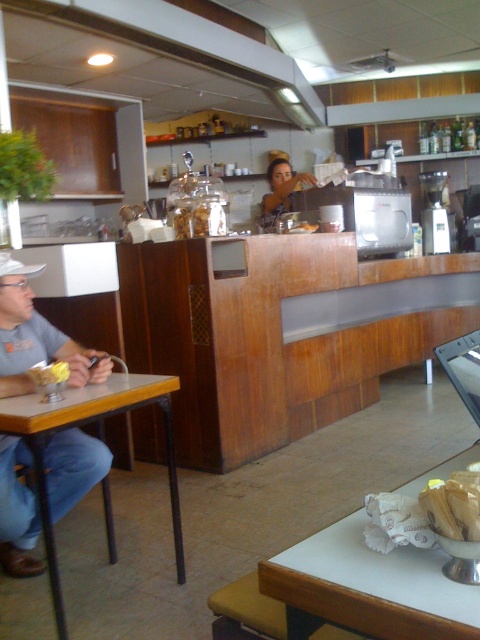
Question: Which of the following is the closest to the observer?

Choices:
 (A) (447, 504)
 (B) (273, 573)
 (C) (0, 474)
 (D) (91, 4)

Answer: (A)

Question: Does white glossy table at lower right appear under matte glass jar at center?

Choices:
 (A) yes
 (B) no

Answer: (A)

Question: Is white glossy table at lower right closer to camera compared to matte brown hair at center?

Choices:
 (A) yes
 (B) no

Answer: (A)

Question: Based on their relative distances, which object is farther from the matte gray shirt at left?

Choices:
 (A) yellow matte butter at table left
 (B) yellow matte bread at lower right
 (C) matte glass jar at center

Answer: (C)

Question: Is matte gray shirt at left below matte glass jar at center?

Choices:
 (A) no
 (B) yes

Answer: (B)

Question: Among these points, which one is nearest to the camera?

Choices:
 (A) (269, 61)
 (B) (312, 179)
 (C) (303, 621)
 (D) (179, 582)

Answer: (C)